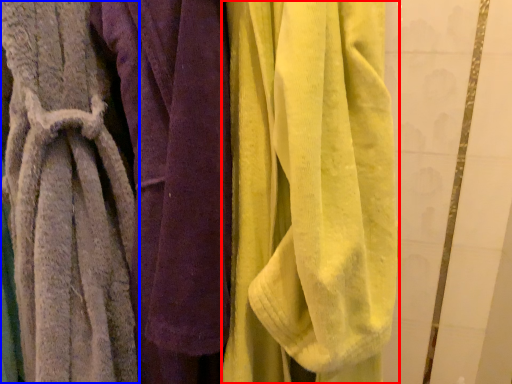
Question: Which object is closer to the camera taking this photo, towel (highlighted by a red box) or towel (highlighted by a blue box)?

Choices:
 (A) towel
 (B) towel

Answer: (A)